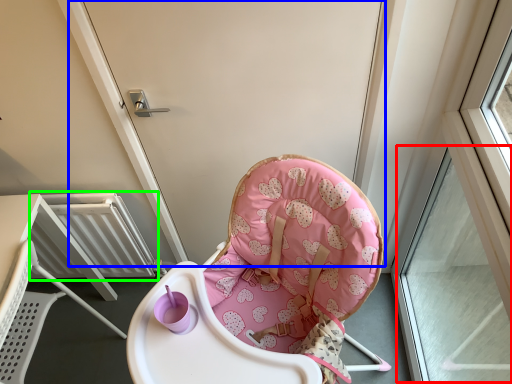
Question: Estimate the real-world distances between objects in this image. Which object is closer to window (highlighted by a red box), screen door (highlighted by a blue box) or radiator (highlighted by a green box)?

Choices:
 (A) screen door
 (B) radiator

Answer: (A)